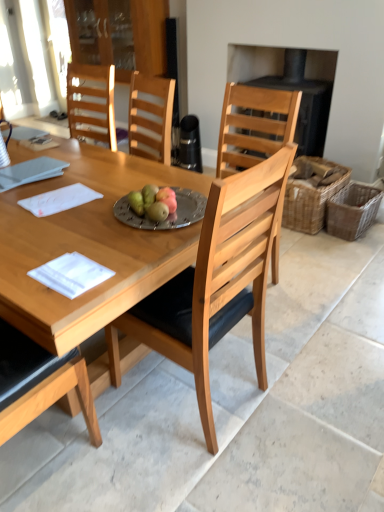
Question: Does white paper at center, the 3th notepad when ordered from back to front, have a greater height compared to woven brown picnic basket at right, the first picnic basket in the right-to-left sequence?

Choices:
 (A) no
 (B) yes

Answer: (A)

Question: Considering the relative sizes of white paper at center, the 3th notepad when ordered from back to front, and woven brown picnic basket at right, which is the second picnic basket in left-to-right order, in the image provided, is white paper at center, the 3th notepad when ordered from back to front, smaller than woven brown picnic basket at right, which is the second picnic basket in left-to-right order,?

Choices:
 (A) yes
 (B) no

Answer: (A)

Question: From a real-world perspective, is white paper at center, the third notepad from the top, located higher than woven brown picnic basket at right, the first picnic basket in the right-to-left sequence?

Choices:
 (A) no
 (B) yes

Answer: (B)

Question: Is white paper at center, the 1th notepad when ordered from bottom to top, outside of woven brown picnic basket at right, which is the second picnic basket in left-to-right order?

Choices:
 (A) no
 (B) yes

Answer: (B)

Question: Is white paper at center, the third notepad from the top, facing away from woven brown picnic basket at right, which is the second picnic basket in left-to-right order?

Choices:
 (A) no
 (B) yes

Answer: (A)

Question: In terms of size, does wooden table at center appear bigger or smaller than transparent glass cabinet at upper center?

Choices:
 (A) big
 (B) small

Answer: (A)

Question: Do you think wooden table at center is within transparent glass cabinet at upper center, or outside of it?

Choices:
 (A) inside
 (B) outside

Answer: (B)

Question: From the image's perspective, is wooden table at center located above or below transparent glass cabinet at upper center?

Choices:
 (A) below
 (B) above

Answer: (A)

Question: In terms of height, does wooden table at center look taller or shorter compared to transparent glass cabinet at upper center?

Choices:
 (A) short
 (B) tall

Answer: (B)

Question: From the image's perspective, is black matte fireplace at upper right above or below transparent glass cabinet at upper center?

Choices:
 (A) above
 (B) below

Answer: (B)

Question: In the image, is black matte fireplace at upper right on the left side or the right side of transparent glass cabinet at upper center?

Choices:
 (A) right
 (B) left

Answer: (A)

Question: Considering the positions of black matte fireplace at upper right and transparent glass cabinet at upper center in the image, is black matte fireplace at upper right taller or shorter than transparent glass cabinet at upper center?

Choices:
 (A) tall
 (B) short

Answer: (A)

Question: Looking at the image, does black matte fireplace at upper right seem bigger or smaller compared to transparent glass cabinet at upper center?

Choices:
 (A) big
 (B) small

Answer: (B)

Question: Is woven brown picnic basket at right, positioned as the 2th picnic basket in right-to-left order, to the left or to the right of silver metallic plate at center in the image?

Choices:
 (A) right
 (B) left

Answer: (A)

Question: From a real-world perspective, relative to silver metallic plate at center, is woven brown picnic basket at right, which ranks as the first picnic basket in left-to-right order, vertically above or below?

Choices:
 (A) above
 (B) below

Answer: (B)